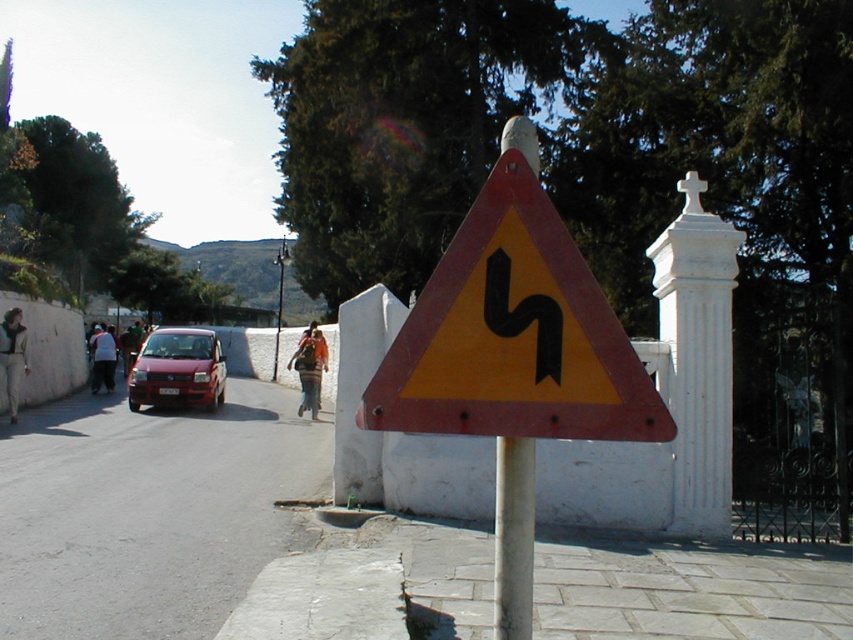
Question: Observing the image, what is the correct spatial positioning of gray concrete curb at lower left in reference to shiny red car at center?

Choices:
 (A) left
 (B) right

Answer: (B)

Question: Does metallic yellow triangle at center have a smaller size compared to gray concrete curb at lower left?

Choices:
 (A) no
 (B) yes

Answer: (B)

Question: Estimate the real-world distances between objects in this image. Which object is farther from the shiny red car at center?

Choices:
 (A) gray concrete curb at lower left
 (B) metallic yellow triangle at center

Answer: (B)

Question: Considering the real-world distances, which object is closest to the metallic yellow triangle at center?

Choices:
 (A) shiny red car at center
 (B) gray concrete curb at lower left

Answer: (B)

Question: Among these objects, which one is farthest from the camera?

Choices:
 (A) shiny red car at center
 (B) metallic yellow triangle at center
 (C) gray concrete curb at lower left

Answer: (A)

Question: Can you confirm if gray concrete curb at lower left is positioned to the right of shiny red car at center?

Choices:
 (A) no
 (B) yes

Answer: (B)